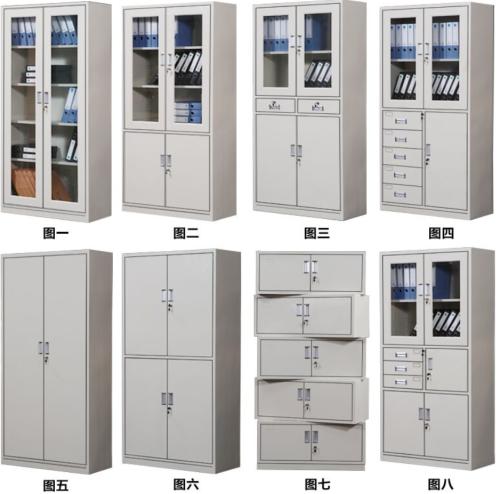
At what (x,y) coordinates should I click in order to perform the action: click on black squares under top row of cabinets. Please return your answer as a coordinate pair (x, y). Looking at the image, I should click on (50, 236), (172, 241), (310, 231), (430, 231).